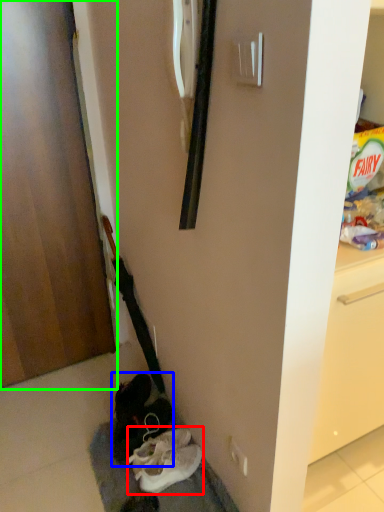
Question: Considering the real-world distances, which object is closest to footwear (highlighted by a red box)? footwear (highlighted by a blue box) or door (highlighted by a green box).

Choices:
 (A) footwear
 (B) door

Answer: (A)